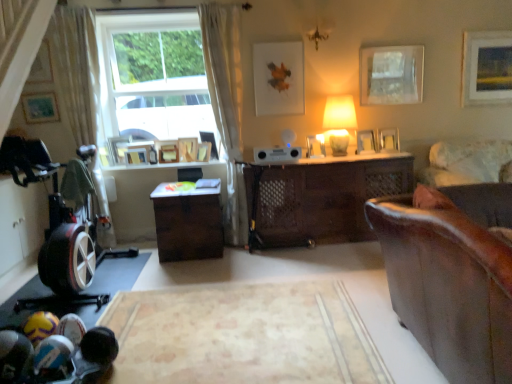
You are a GUI agent. You are given a task and a screenshot of the screen. Output one action in this format:
    pyautogui.click(x=<x>, y=<y>)
    Task: Click on the space that is in front of brown matte desk at center, placed as the 2th desk when sorted from right to left
    
    Given the screenshot: What is the action you would take?
    pyautogui.click(x=168, y=273)